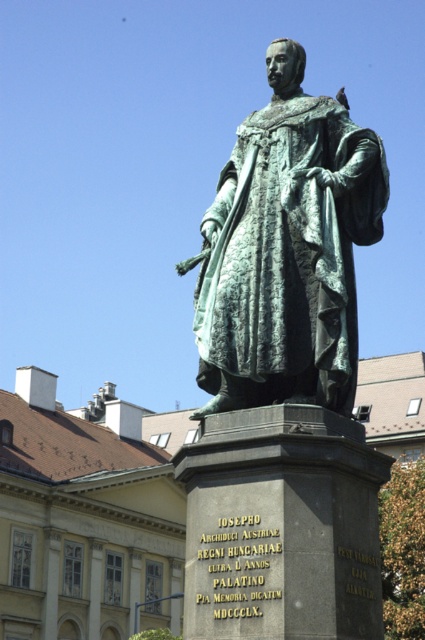
Who is positioned more to the left, green patina statue at center or green patina bronze statue at center?

Positioned to the left is green patina statue at center.

From the picture: Is green patina statue at center positioned at the back of green patina bronze statue at center?

That is True.

Which is in front, point (98, 616) or point (302, 116)?

Point (302, 116) is in front.

Find the location of a particular element. Image resolution: width=425 pixels, height=640 pixels. green patina statue at center is located at coordinates (87, 513).